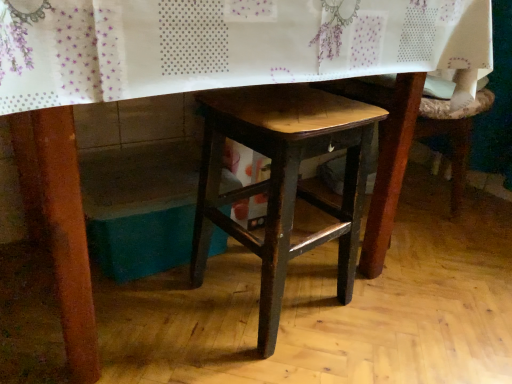
The width and height of the screenshot is (512, 384). What do you see at coordinates (282, 180) in the screenshot?
I see `wooden stool at center` at bounding box center [282, 180].

Identify the location of wooden stool at center. This screenshot has height=384, width=512. (282, 180).

At what (x,y) coordinates should I click in order to perform the action: click on wooden stool at center. Please return your answer as a coordinate pair (x, y). Image resolution: width=512 pixels, height=384 pixels. Looking at the image, I should click on (282, 180).